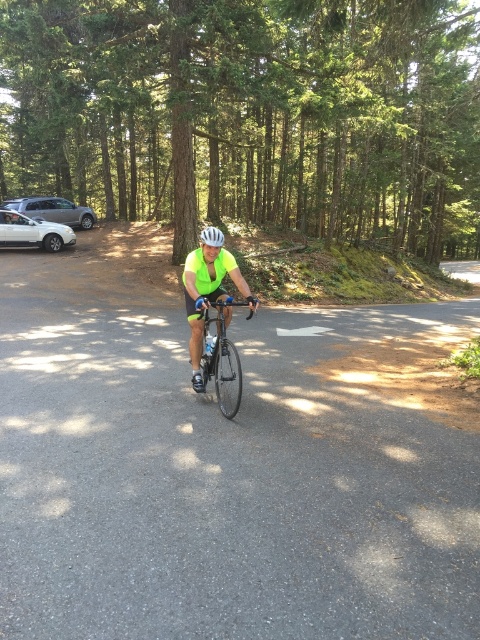
Question: Is neon yellow jersey at center positioned before shiny black bicycle at center?

Choices:
 (A) no
 (B) yes

Answer: (A)

Question: Which of the following is the farthest from the observer?

Choices:
 (A) (232, 392)
 (B) (194, 378)
 (C) (205, 236)

Answer: (B)

Question: Which object is positioned farthest from the white matte sedan at left?

Choices:
 (A) white matte bicycle helmet at center
 (B) shiny black bicycle at center
 (C) neon yellow jersey at center

Answer: (C)

Question: Which point is closer to the camera?

Choices:
 (A) white matte sedan at left
 (B) white matte bicycle helmet at center

Answer: (B)

Question: Is neon yellow jersey at center closer to the viewer compared to shiny black bicycle at center?

Choices:
 (A) yes
 (B) no

Answer: (B)

Question: Does neon yellow jersey at center appear under shiny black bicycle at center?

Choices:
 (A) yes
 (B) no

Answer: (B)